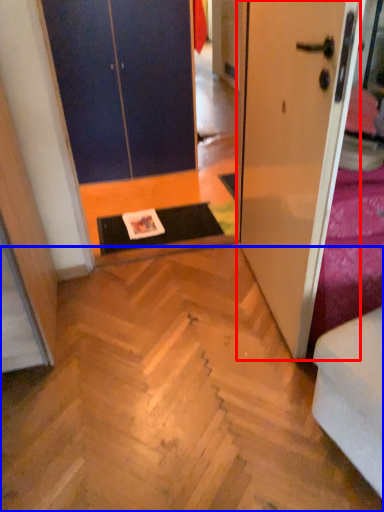
Question: Which object is further to the camera taking this photo, door (highlighted by a red box) or stairwell (highlighted by a blue box)?

Choices:
 (A) door
 (B) stairwell

Answer: (B)